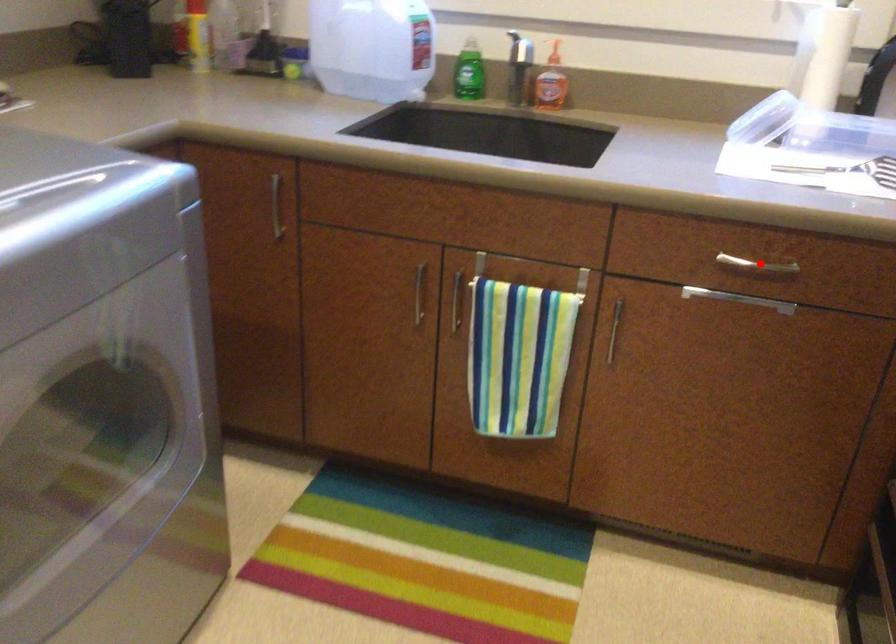
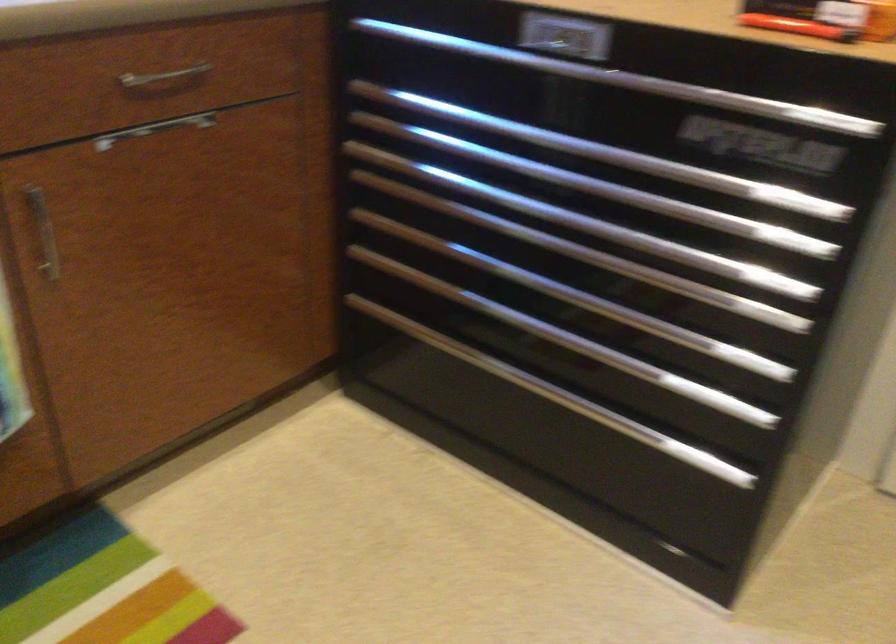
Question: I am providing you with two images of the same scene from different viewpoints. Image1 has a red point marked. In image2, the corresponding 3D location appears at what relative position? Reply with the corresponding letter.

Choices:
 (A) Closer
 (B) Farther

Answer: (A)